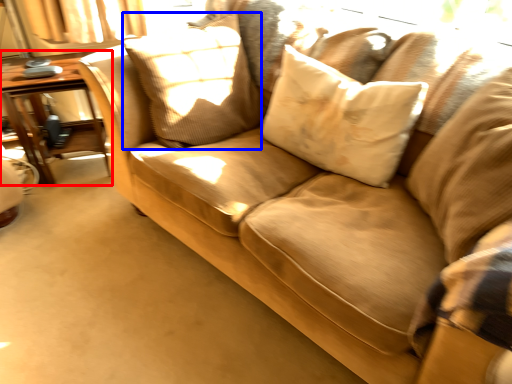
Question: Among these objects, which one is nearest to the camera, table (highlighted by a red box) or pillow (highlighted by a blue box)?

Choices:
 (A) table
 (B) pillow

Answer: (B)